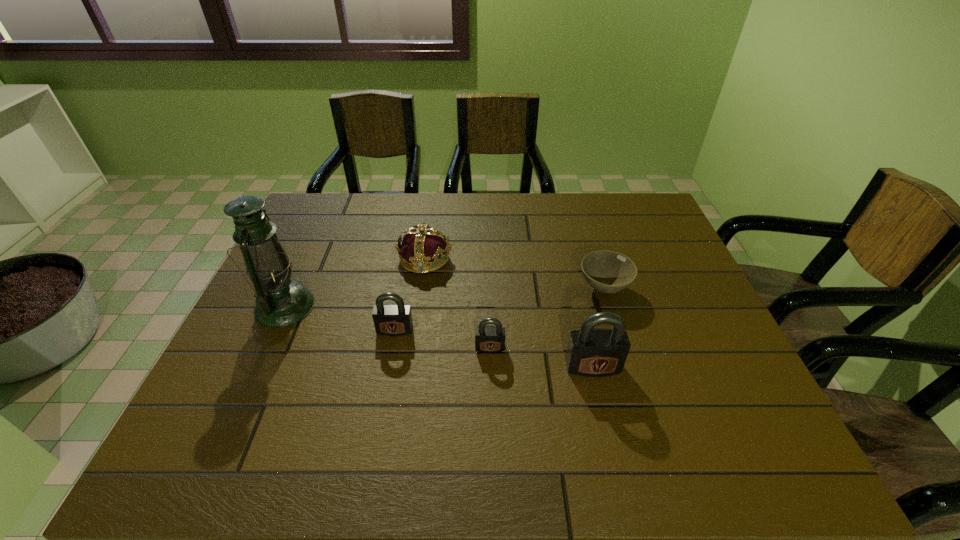
This screenshot has width=960, height=540. What are the coordinates of `the farthest padlock` in the screenshot? It's located at (389, 319).

At what (x,y) coordinates should I click in order to perform the action: click on the second tallest padlock. Please return your answer as a coordinate pair (x, y). The height and width of the screenshot is (540, 960). Looking at the image, I should click on (389, 319).

At what (x,y) coordinates should I click in order to perform the action: click on the second nearest object. Please return your answer as a coordinate pair (x, y). The width and height of the screenshot is (960, 540). Looking at the image, I should click on (489, 339).

Locate an element on the screen. Image resolution: width=960 pixels, height=540 pixels. the second padlock from right to left is located at coordinates (489, 339).

The height and width of the screenshot is (540, 960). I want to click on the nearest object, so click(x=592, y=352).

You are a GUI agent. You are given a task and a screenshot of the screen. Output one action in this format:
    pyautogui.click(x=<x>, y=<y>)
    Task: Click on the fifth shortest object
    The width and height of the screenshot is (960, 540).
    Given the screenshot: What is the action you would take?
    pyautogui.click(x=592, y=352)

Locate an element on the screen. The height and width of the screenshot is (540, 960). crown is located at coordinates (421, 245).

Identify the location of the shortest object. The height and width of the screenshot is (540, 960). [x=606, y=271].

I want to click on the leftmost object, so click(x=280, y=301).

Locate an element on the screen. The width and height of the screenshot is (960, 540). oil lamp is located at coordinates (280, 301).